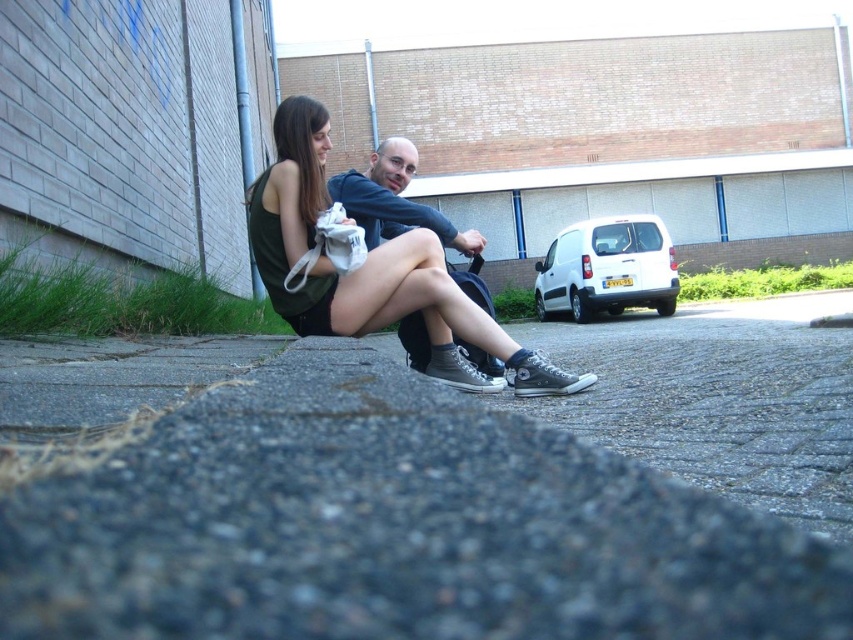
Question: Which object is farther from the camera taking this photo?

Choices:
 (A) matte black hoodie at center
 (B) matte black sneakers at center

Answer: (A)

Question: Considering the real-world distances, which object is farthest from the matte black sneakers at center?

Choices:
 (A) matte black hoodie at center
 (B) gray asphalt at center

Answer: (B)

Question: Among these objects, which one is farthest from the camera?

Choices:
 (A) white matte van at upper right
 (B) matte black sneakers at center
 (C) gray asphalt at center

Answer: (A)

Question: Can you confirm if gray asphalt at center is positioned to the right of matte black sneakers at center?

Choices:
 (A) yes
 (B) no

Answer: (A)

Question: Is white matte van at upper right in front of matte black hoodie at center?

Choices:
 (A) yes
 (B) no

Answer: (B)

Question: Is white matte van at upper right bigger than matte black hoodie at center?

Choices:
 (A) yes
 (B) no

Answer: (A)